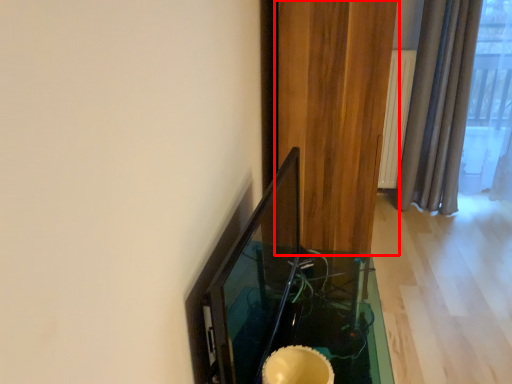
Question: From the image's perspective, what is the correct spatial relationship of curtain (annotated by the red box) in relation to table?

Choices:
 (A) above
 (B) below

Answer: (A)